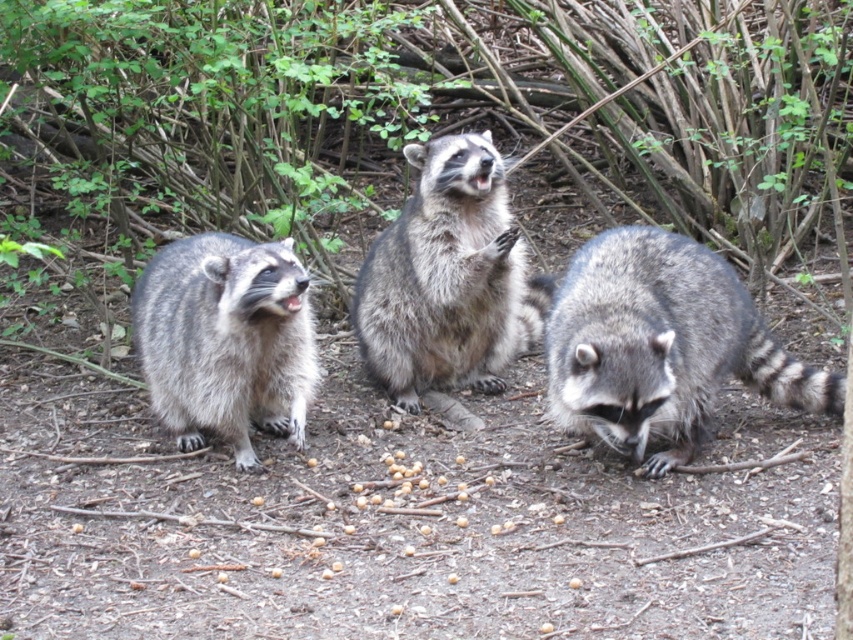
You are a photographer aiming to capture the gray fur raccoon at lower right. Based on its position coordinates, where should you focus your camera lens?

The gray fur raccoon at lower right is located at coordinates point [660,346], so you should focus your camera lens at that point to capture it.

You are a wildlife photographer trying to capture a photo of the fuzzy gray raccoon at center and the gray fur raccoon at left. Your camera has a maximum focus range of 30 inches. Can you fit both raccoons into the same frame without moving closer?

The fuzzy gray raccoon at center and the gray fur raccoon at left are 31.96 inches apart. Since the distance between them exceeds the camera maximum focus range of 30 inches, you cannot fit both raccoons into the same frame without moving closer.

You are a wildlife photographer aiming to capture a closeup of the fuzzy gray raccoon at center and the gray fur raccoon at left. Given that the camera lens can only focus on one raccoon at a time, which raccoon should you focus on to ensure the larger one is in the frame?

The fuzzy gray raccoon at center is bigger than the gray fur raccoon at left, so you should focus on the fuzzy gray raccoon at center to ensure the larger one is in the frame.